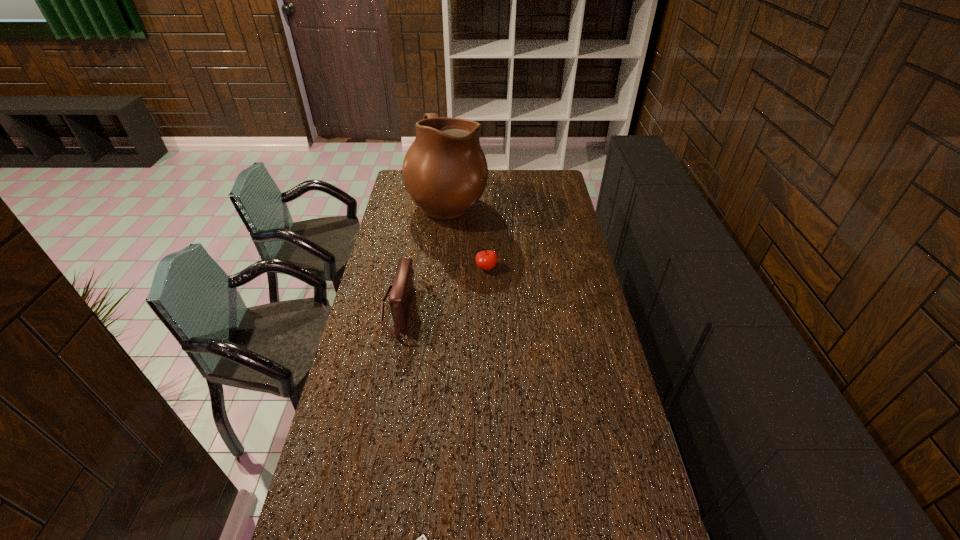
Where is `cream pitcher at the left edge`? Image resolution: width=960 pixels, height=540 pixels. cream pitcher at the left edge is located at coordinates (445, 172).

Locate an element on the screen. The width and height of the screenshot is (960, 540). shoulder bag positioned at the left edge is located at coordinates (402, 288).

Identify the location of object located at the far left corner. (445, 172).

This screenshot has height=540, width=960. I want to click on vacant point at the left edge, so click(362, 424).

Where is `vacant space at the right edge`? vacant space at the right edge is located at coordinates (602, 509).

The image size is (960, 540). I want to click on vacant space at the far left corner of the desktop, so click(399, 175).

Find the location of a particular element. This screenshot has width=960, height=540. vacant space at the far right corner is located at coordinates (540, 186).

The image size is (960, 540). Identify the location of vacant area between the cream pitcher and the apple. (468, 234).

You are a GUI agent. You are given a task and a screenshot of the screen. Output one action in this format:
    pyautogui.click(x=<x>, y=<y>)
    Task: Click on the empty space that is in between the third tallest object and the shoulder bag
    Image resolution: width=960 pixels, height=540 pixels.
    Given the screenshot: What is the action you would take?
    pyautogui.click(x=443, y=288)

Locate an element on the screen. unoccupied area between the tallest object and the second tallest object is located at coordinates (423, 254).